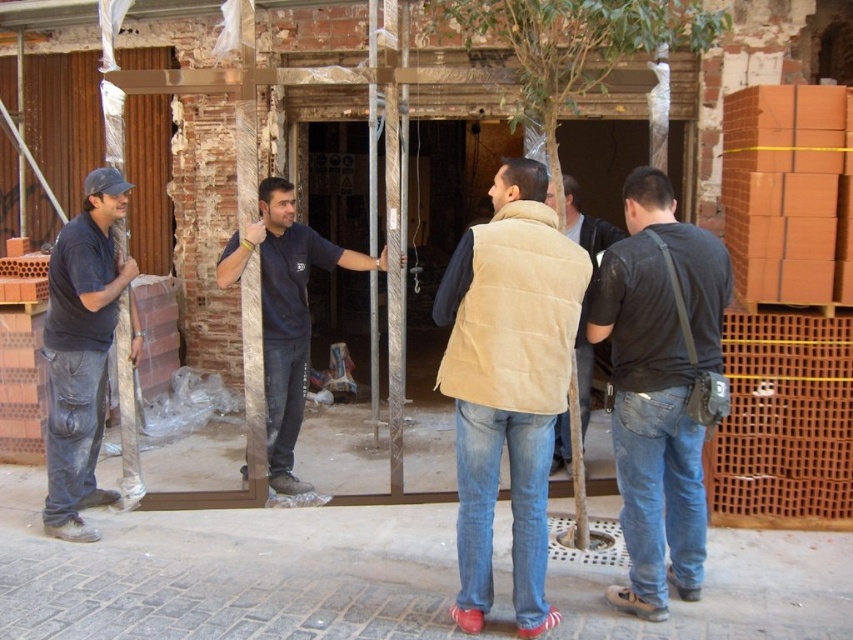
Does beige suede vest at center have a greater width compared to beige quilted vest at center?

Yes.

Which of these two, beige suede vest at center or beige quilted vest at center, stands shorter?

beige quilted vest at center

Between point (502, 380) and point (592, 257), which one is positioned in front?

Point (502, 380)

Where is `beige suede vest at center`? beige suede vest at center is located at coordinates (508, 381).

Can you confirm if dark blue shirt at center is positioned to the right of beige quilted vest at center?

Incorrect, dark blue shirt at center is not on the right side of beige quilted vest at center.

Does dark blue shirt at center have a greater height compared to beige quilted vest at center?

Indeed, dark blue shirt at center has a greater height compared to beige quilted vest at center.

Is point (297, 435) less distant than point (581, 243)?

No.

At what (x,y) coordinates should I click in order to perform the action: click on dark blue shirt at center. Please return your answer as a coordinate pair (x, y). Looking at the image, I should click on (285, 312).

Does black denim jeans at right have a lesser height compared to matte black shirt at left?

Indeed, black denim jeans at right has a lesser height compared to matte black shirt at left.

Can you confirm if black denim jeans at right is bigger than matte black shirt at left?

No, black denim jeans at right is not bigger than matte black shirt at left.

Locate an element on the screen. Image resolution: width=853 pixels, height=640 pixels. black denim jeans at right is located at coordinates (659, 387).

This screenshot has width=853, height=640. What are the coordinates of `black denim jeans at right` in the screenshot? It's located at (659, 387).